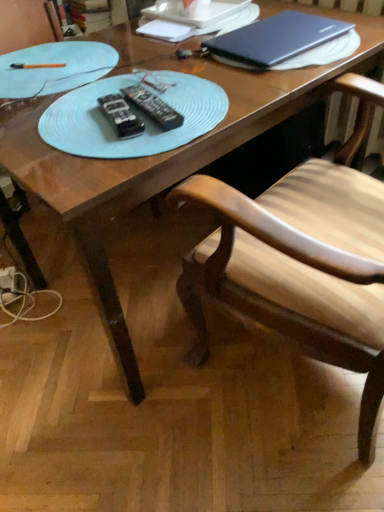
I want to click on vacant space to the right of black plastic remote at center, the first remote positioned from the left, so click(x=203, y=104).